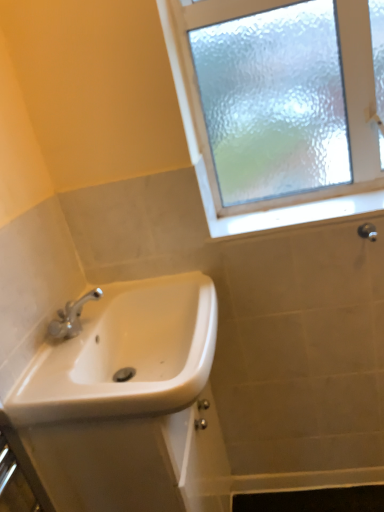
Question: Can you confirm if white glossy window sill at upper right is positioned to the right of frosted glass window at upper right?

Choices:
 (A) yes
 (B) no

Answer: (A)

Question: Is white glossy window sill at upper right aimed at frosted glass window at upper right?

Choices:
 (A) yes
 (B) no

Answer: (B)

Question: Does white glossy window sill at upper right lie in front of frosted glass window at upper right?

Choices:
 (A) yes
 (B) no

Answer: (B)

Question: Can you confirm if white glossy window sill at upper right is thinner than frosted glass window at upper right?

Choices:
 (A) yes
 (B) no

Answer: (B)

Question: Is there a large distance between white glossy window sill at upper right and frosted glass window at upper right?

Choices:
 (A) no
 (B) yes

Answer: (A)

Question: Would you say white glossy window sill at upper right is inside or outside matte silver shower at upper right?

Choices:
 (A) inside
 (B) outside

Answer: (B)

Question: Is point (210, 210) positioned closer to the camera than point (369, 224)?

Choices:
 (A) closer
 (B) farther

Answer: (B)

Question: Is white glossy window sill at upper right taller or shorter than matte silver shower at upper right?

Choices:
 (A) tall
 (B) short

Answer: (B)

Question: Based on their sizes in the image, would you say white glossy window sill at upper right is bigger or smaller than matte silver shower at upper right?

Choices:
 (A) big
 (B) small

Answer: (A)

Question: Looking at their shapes, would you say white ceramic sink at lower left is wider or thinner than matte silver shower at upper right?

Choices:
 (A) wide
 (B) thin

Answer: (A)

Question: From the image's perspective, is white ceramic sink at lower left above or below matte silver shower at upper right?

Choices:
 (A) above
 (B) below

Answer: (B)

Question: Is white ceramic sink at lower left taller or shorter than matte silver shower at upper right?

Choices:
 (A) tall
 (B) short

Answer: (A)

Question: Relative to matte silver shower at upper right, is white ceramic sink at lower left in front or behind?

Choices:
 (A) behind
 (B) front

Answer: (B)

Question: From a real-world perspective, relative to white ceramic sink at lower left, is frosted glass window at upper right vertically above or below?

Choices:
 (A) above
 (B) below

Answer: (A)

Question: Considering the positions of point (183, 116) and point (130, 403), is point (183, 116) closer or farther from the camera than point (130, 403)?

Choices:
 (A) farther
 (B) closer

Answer: (A)